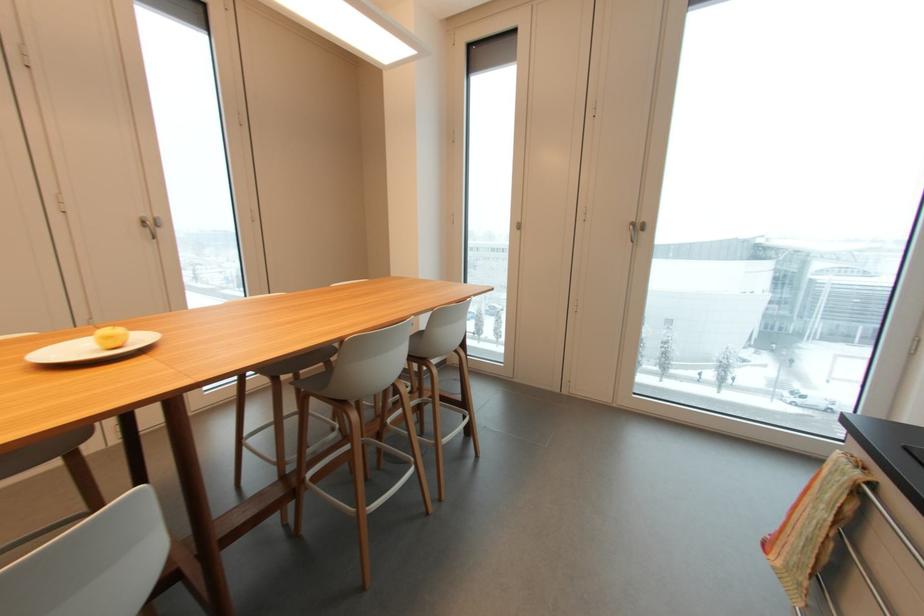
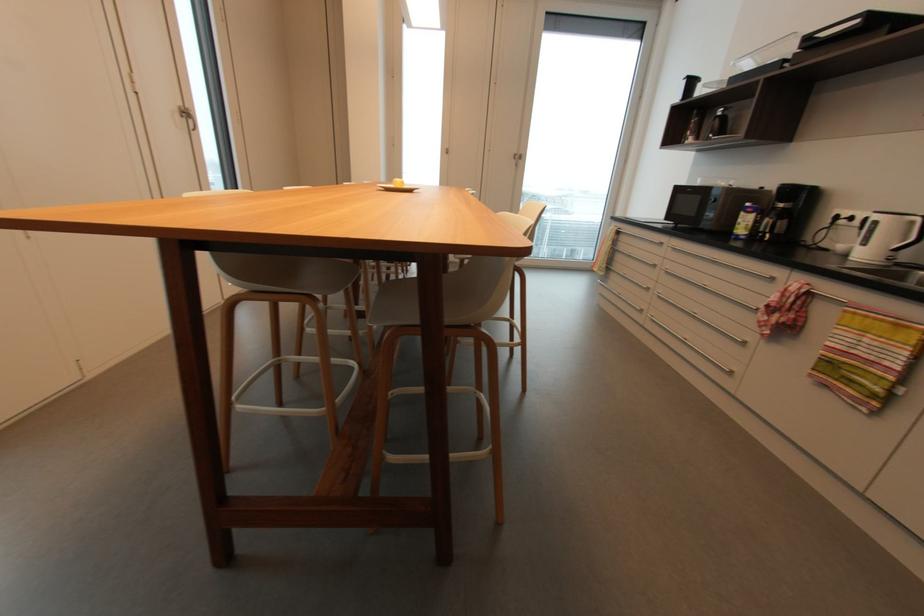
Find the pixel in the second image that matches point (143, 217) in the first image.

(183, 108)